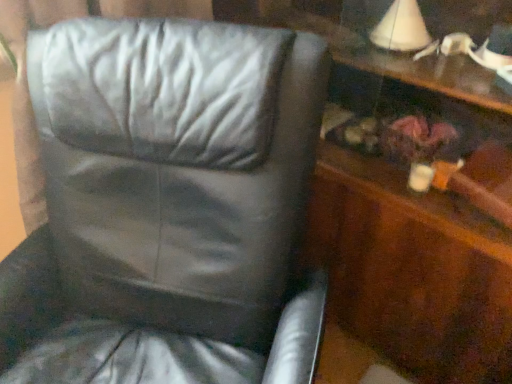
Describe the element at coordinates (163, 202) in the screenshot. This screenshot has height=384, width=512. I see `black leather chair at center` at that location.

This screenshot has width=512, height=384. Identify the location of black leather chair at center. (163, 202).

Measure the distance between point (334, 26) and camera.

The distance of point (334, 26) from camera is 1.14 meters.

The image size is (512, 384). What do you see at coordinates (411, 211) in the screenshot?
I see `wooden dresser at right` at bounding box center [411, 211].

What are the coordinates of `wooden dresser at right` in the screenshot? It's located at (411, 211).

What are the coordinates of `black leather chair at center` in the screenshot? It's located at (163, 202).

Visually, is wooden dresser at right positioned to the left or to the right of black leather chair at center?

wooden dresser at right is positioned on black leather chair at center's right side.

Considering their positions, is wooden dresser at right located in front of or behind black leather chair at center?

wooden dresser at right is positioned farther from the viewer than black leather chair at center.

Considering the points (357, 322) and (203, 347), which point is behind, point (357, 322) or point (203, 347)?

The point (357, 322) is more distant.

From the image's perspective, is wooden dresser at right beneath black leather chair at center?

No, from the image's perspective, wooden dresser at right is not below black leather chair at center.

From a real-world perspective, who is located higher, wooden dresser at right or black leather chair at center?

wooden dresser at right, from a real-world perspective.

Considering the sizes of objects wooden dresser at right and black leather chair at center in the image provided, who is thinner, wooden dresser at right or black leather chair at center?

wooden dresser at right is thinner.

In terms of height, does wooden dresser at right look taller or shorter compared to black leather chair at center?

Considering their sizes, wooden dresser at right has more height than black leather chair at center.

Considering the sizes of wooden dresser at right and black leather chair at center in the image, is wooden dresser at right bigger or smaller than black leather chair at center?

wooden dresser at right is smaller than black leather chair at center.

Can black leather chair at center be found inside wooden dresser at right?

No, black leather chair at center is not inside wooden dresser at right.

Is there a large distance between wooden dresser at right and black leather chair at center?

wooden dresser at right is near black leather chair at center, not far away.

Could you tell me if wooden dresser at right is facing black leather chair at center?

Yes.

In the scene shown: How many degrees apart are the facing directions of wooden dresser at right and black leather chair at center?

26.4 degrees separate the facing orientations of wooden dresser at right and black leather chair at center.

You are a GUI agent. You are given a task and a screenshot of the screen. Output one action in this format:
    pyautogui.click(x=<x>, y=<y>)
    Task: Click on the dresser on the right of the black leather chair at center
    Image resolution: width=512 pixels, height=384 pixels.
    Given the screenshot: What is the action you would take?
    pyautogui.click(x=411, y=211)

Considering the positions of objects black leather chair at center and wooden dresser at right in the image provided, who is more to the right, black leather chair at center or wooden dresser at right?

wooden dresser at right.

Does black leather chair at center come behind wooden dresser at right?

No, black leather chair at center is closer to the camera.

Is point (240, 135) closer or farther from the camera than point (477, 206)?

Point (240, 135).

From the image's perspective, is black leather chair at center located above or below wooden dresser at right?

From the image's perspective, black leather chair at center appears below wooden dresser at right.

From a real-world perspective, is black leather chair at center located higher than wooden dresser at right?

No, from a real-world perspective, black leather chair at center is not above wooden dresser at right.

Considering the relative sizes of black leather chair at center and wooden dresser at right in the image provided, is black leather chair at center wider than wooden dresser at right?

Indeed, black leather chair at center has a greater width compared to wooden dresser at right.

From the picture: Which of these two, black leather chair at center or wooden dresser at right, stands taller?

With more height is wooden dresser at right.

In the scene shown: Which of these two, black leather chair at center or wooden dresser at right, is bigger?

Bigger between the two is black leather chair at center.

Choose the correct answer: Is black leather chair at center inside wooden dresser at right or outside it?

black leather chair at center is not inside wooden dresser at right, it's outside.

Is black leather chair at center in contact with wooden dresser at right?

No, black leather chair at center is not touching wooden dresser at right.

Is black leather chair at center looking in the opposite direction of wooden dresser at right?

Yes, black leather chair at center is facing away from wooden dresser at right.

Can you tell me how much black leather chair at center and wooden dresser at right differ in facing direction?

The angular difference between black leather chair at center and wooden dresser at right is 26.4 degrees.

Where is `chair located below the wooden dresser at right (from the image's perspective)`? The height and width of the screenshot is (384, 512). chair located below the wooden dresser at right (from the image's perspective) is located at coordinates (163, 202).

This screenshot has height=384, width=512. I want to click on chair below the wooden dresser at right (from the image's perspective), so (x=163, y=202).

Where is `dresser above the black leather chair at center (from the image's perspective)`? dresser above the black leather chair at center (from the image's perspective) is located at coordinates (411, 211).